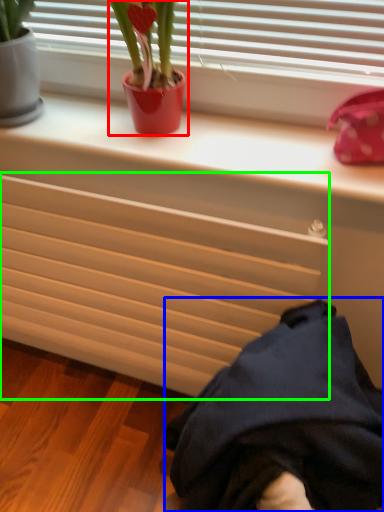
Question: Which object is the farthest from houseplant (highlighted by a red box)? Choose among these: clothing (highlighted by a blue box) or radiator (highlighted by a green box).

Choices:
 (A) clothing
 (B) radiator

Answer: (A)